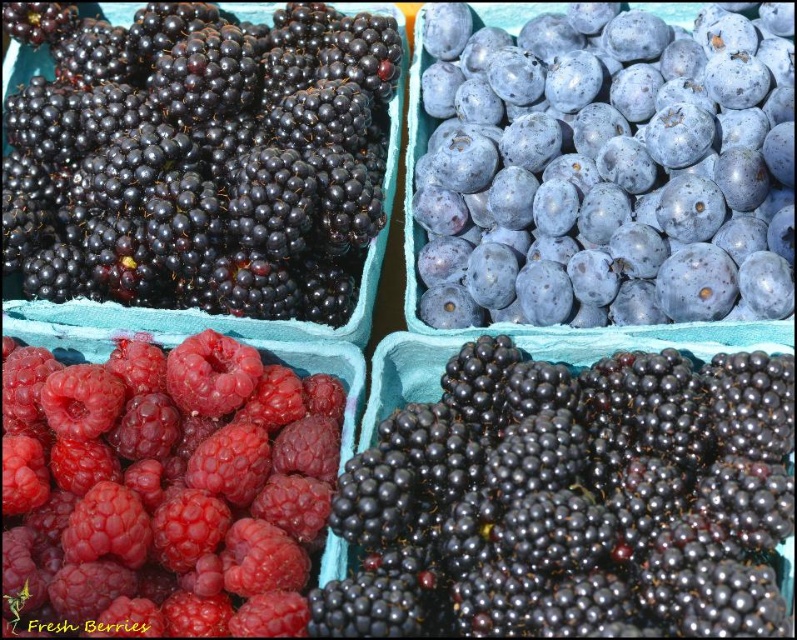
You are a customer at a berry stand and want to buy the glossy red raspberry at lower left and the shiny black berries at upper left. Which one would you reach for first if you are standing in front of the display?

You would reach for the glossy red raspberry at lower left first because it is in front of the shiny black berries at upper left, making it closer to you.

You are a customer at a berry stand and want to buy the shiny black berries at upper left and the glossy red raspberry at lower left. Which container should you look up towards or down towards from your current position?

The shiny black berries at upper left are located above the glossy red raspberry at lower left. So, you should look up towards to find the shiny black berries at upper left and down towards to find the glossy red raspberry at lower left.